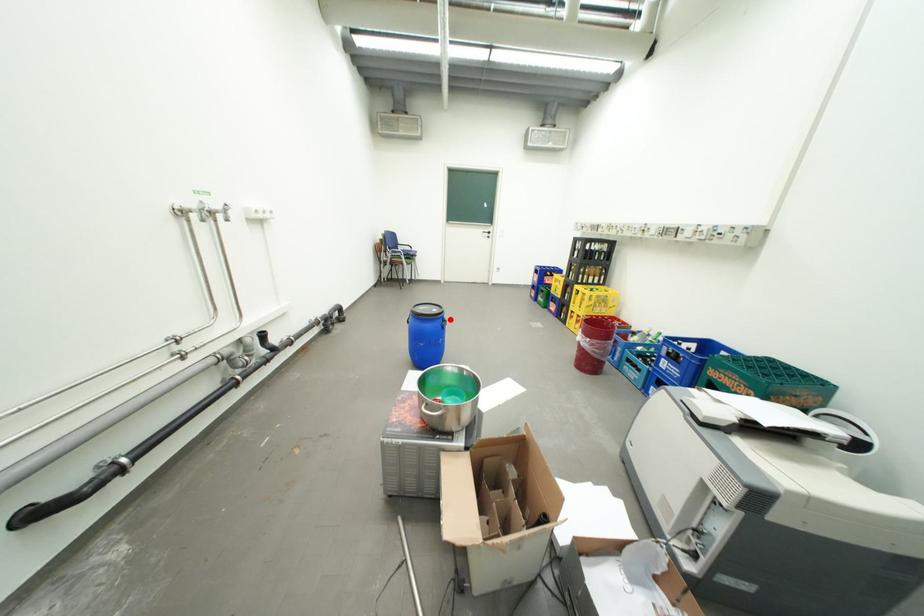
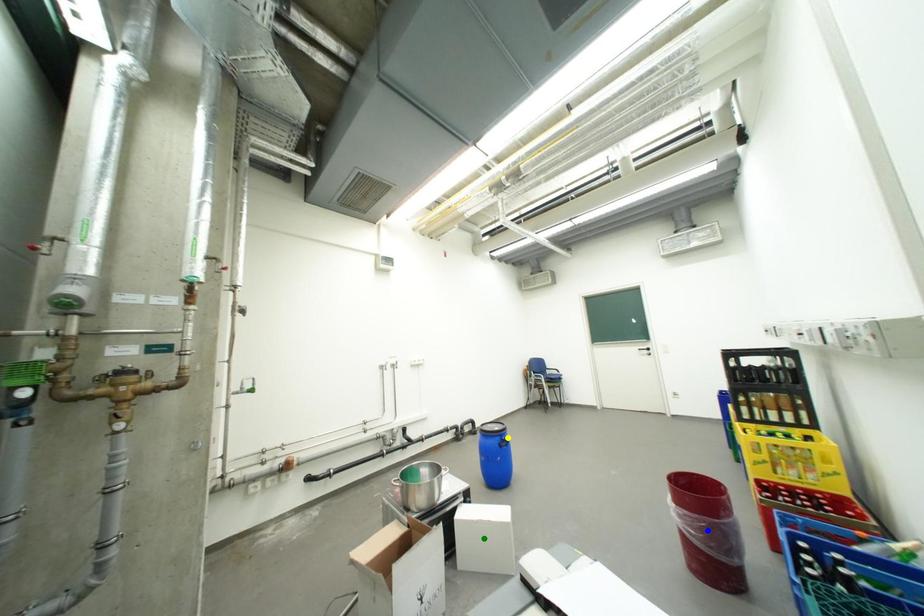
Question: I am providing you with two images of the same scene from different viewpoints. A red point is marked on the first image. You are given multiple points on the second image. Which spot in image 2 lines up with the point in image 1?

Choices:
 (A) green point
 (B) blue point
 (C) yellow point

Answer: (C)